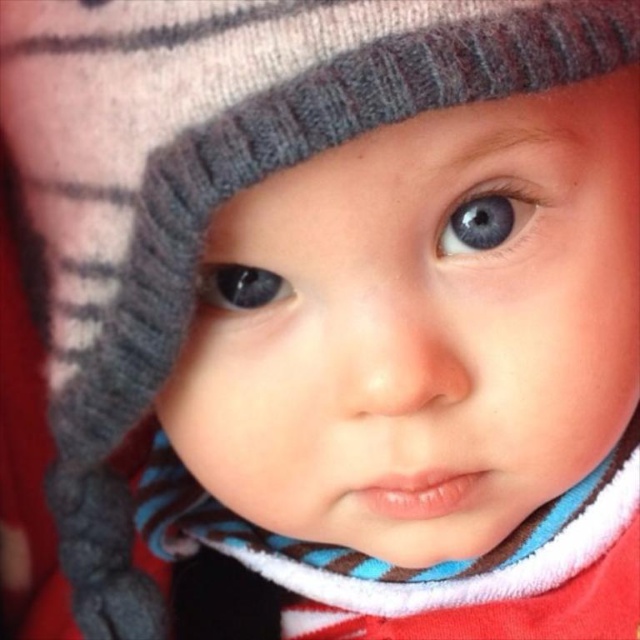
Question: Does blue striped scarf at center appear on the left side of blue matte eye at upper center?

Choices:
 (A) no
 (B) yes

Answer: (B)

Question: Does blue striped scarf at center appear on the left side of matte blue eye at center?

Choices:
 (A) yes
 (B) no

Answer: (B)

Question: Can you confirm if blue striped scarf at center is bigger than blue matte eye at upper center?

Choices:
 (A) yes
 (B) no

Answer: (A)

Question: Considering the real-world distances, which object is closest to the blue matte eye at upper center?

Choices:
 (A) matte blue eye at center
 (B) blue striped scarf at center

Answer: (A)

Question: Estimate the real-world distances between objects in this image. Which object is farther from the matte blue eye at center?

Choices:
 (A) blue matte eye at upper center
 (B) blue striped scarf at center

Answer: (B)

Question: Which of these objects is positioned farthest from the matte blue eye at center?

Choices:
 (A) blue matte eye at upper center
 (B) blue striped scarf at center

Answer: (B)